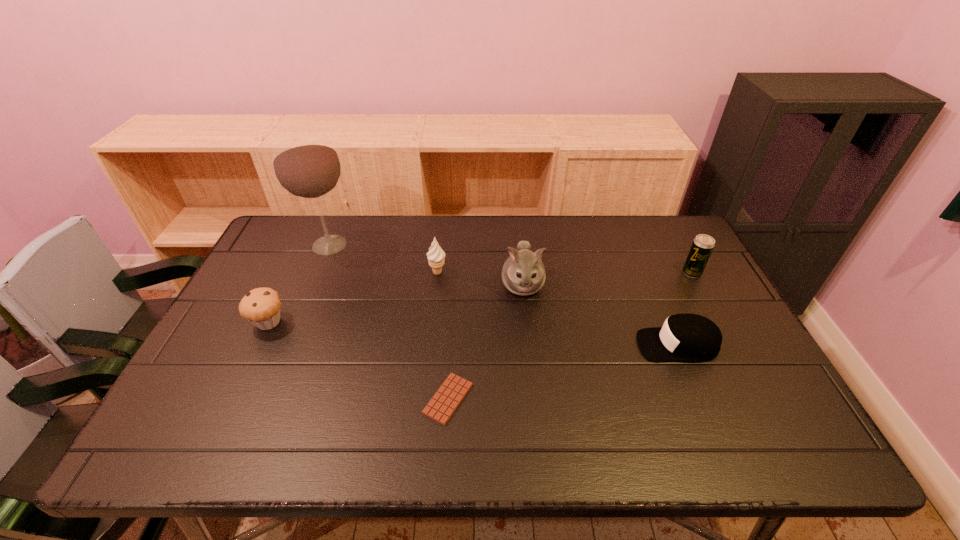
Find the location of a particular element. object positioned at the near edge is located at coordinates (446, 400).

This screenshot has width=960, height=540. Identify the location of alcohol located at the left edge. (306, 165).

The image size is (960, 540). I want to click on muffin that is at the left edge, so click(261, 306).

Image resolution: width=960 pixels, height=540 pixels. Identify the location of beer can at the right edge. (703, 245).

Locate an element on the screen. This screenshot has width=960, height=540. cap at the right edge is located at coordinates (684, 337).

In order to click on object that is at the far left corner in this screenshot , I will do `click(306, 165)`.

Locate an element on the screen. The width and height of the screenshot is (960, 540). free space at the far edge is located at coordinates (396, 245).

The image size is (960, 540). What are the coordinates of `free space at the near edge` in the screenshot? It's located at (647, 428).

This screenshot has width=960, height=540. In the image, there is a desktop. What are the coordinates of `vacant space at the left edge` in the screenshot? It's located at (267, 343).

At what (x,y) coordinates should I click in order to perform the action: click on free space at the right edge of the desktop. Please return your answer as a coordinate pair (x, y). The width and height of the screenshot is (960, 540). Looking at the image, I should click on (681, 291).